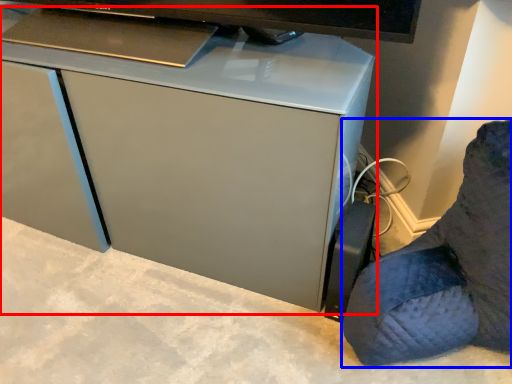
Question: Among these objects, which one is farthest to the camera, computer desk (highlighted by a red box) or furniture (highlighted by a blue box)?

Choices:
 (A) computer desk
 (B) furniture

Answer: (A)